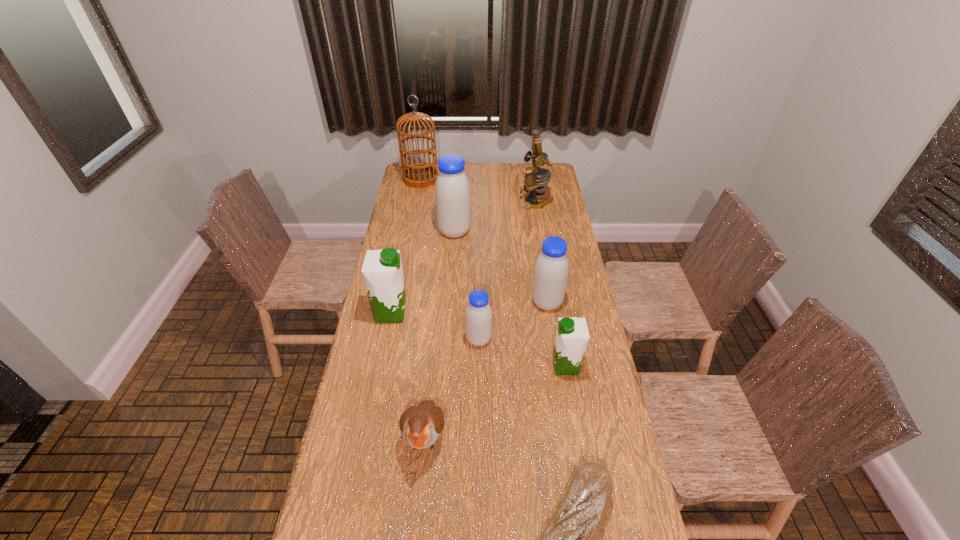
At what (x,y) coordinates should I click in order to perform the action: click on free location at the left edge of the desktop. Please return your answer as a coordinate pair (x, y). The width and height of the screenshot is (960, 540). Looking at the image, I should click on (408, 264).

Image resolution: width=960 pixels, height=540 pixels. In the image, there is a desktop. What are the coordinates of `vacant region at the right edge` in the screenshot? It's located at (569, 273).

The height and width of the screenshot is (540, 960). What are the coordinates of `free space between the nearest soya milk and the farthest object` in the screenshot? It's located at pyautogui.click(x=493, y=272).

Find the location of a particular element. Image resolution: width=960 pixels, height=540 pixels. free spot between the farthest blue soya milk and the eighth tallest object is located at coordinates (440, 334).

Where is `free space between the farthest blue soya milk and the fourth farthest soya milk`? free space between the farthest blue soya milk and the fourth farthest soya milk is located at coordinates click(467, 285).

Where is `vacant space that is in between the farthest soya milk and the microscope`? This screenshot has height=540, width=960. vacant space that is in between the farthest soya milk and the microscope is located at coordinates (495, 217).

Where is `blank region between the second farthest blue soya milk and the farthest object`? The height and width of the screenshot is (540, 960). blank region between the second farthest blue soya milk and the farthest object is located at coordinates (484, 241).

Identify the location of object that can be found as the third closest to the bigger green soya milk. The height and width of the screenshot is (540, 960). (452, 189).

Identify which object is located as the nearest to the sixth farthest object. Please provide its 2D coordinates. Your answer should be formatted as a tuple, i.e. [(x, y)], where the tuple contains the x and y coordinates of a point satisfying the conditions above.

[(551, 270)]

Select which soya milk is the closest to the farther green soya milk. Please provide its 2D coordinates. Your answer should be formatted as a tuple, i.e. [(x, y)], where the tuple contains the x and y coordinates of a point satisfying the conditions above.

[(478, 316)]